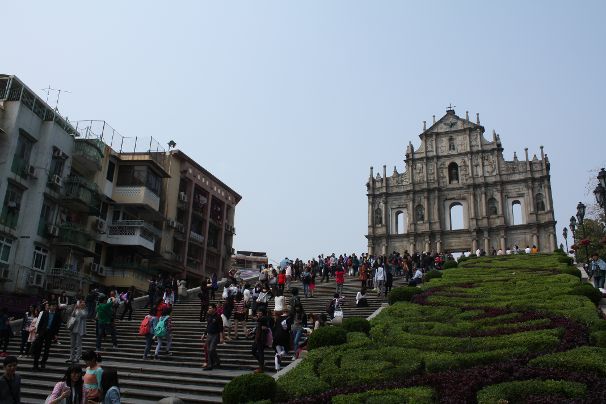
This screenshot has height=404, width=606. In order to click on stairs in this screenshot , I will do `click(185, 339)`.